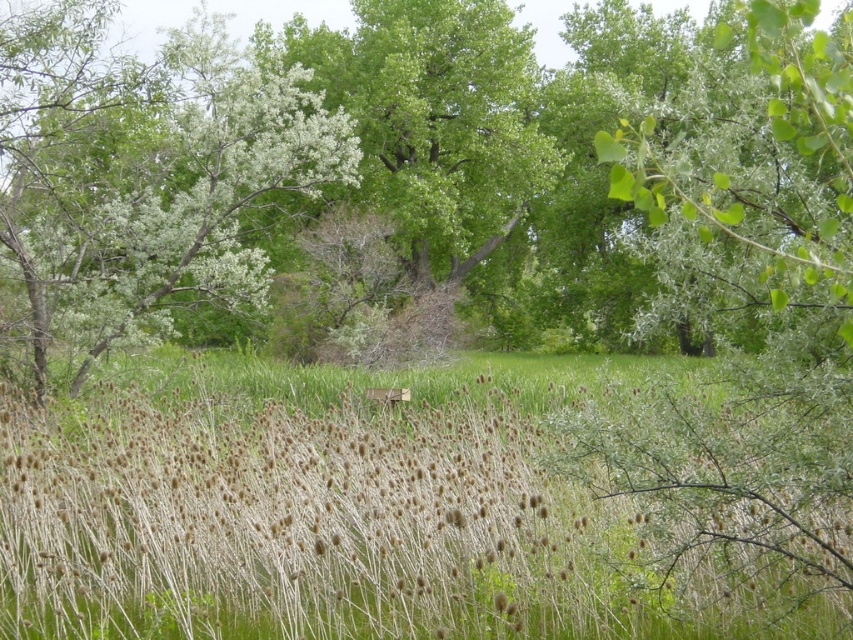
Consider the image. Which is below, brown dry grass at center or green leafy tree at center?

brown dry grass at center is lower down.

Is point (49, 481) positioned before point (817, 564)?

No, (49, 481) is behind (817, 564).

Which is behind, point (508, 536) or point (630, 406)?

Point (508, 536)

You are a GUI agent. You are given a task and a screenshot of the screen. Output one action in this format:
    pyautogui.click(x=<x>, y=<y>)
    Task: Click on the brown dry grass at center
    
    Given the screenshot: What is the action you would take?
    pyautogui.click(x=345, y=512)

Who is lower down, green leafy tree at upper left or green leafy tree at center?

green leafy tree at center is below.

Who is positioned more to the right, green leafy tree at upper left or green leafy tree at center?

From the viewer's perspective, green leafy tree at center appears more on the right side.

The image size is (853, 640). Describe the element at coordinates (141, 177) in the screenshot. I see `green leafy tree at upper left` at that location.

Where is `green leafy tree at upper left`? The width and height of the screenshot is (853, 640). green leafy tree at upper left is located at coordinates (141, 177).

Does brown dry grass at center appear over green leafy tree at upper left?

Incorrect, brown dry grass at center is not positioned above green leafy tree at upper left.

In the scene shown: Who is shorter, brown dry grass at center or green leafy tree at upper left?

brown dry grass at center

This screenshot has height=640, width=853. Describe the element at coordinates (345, 512) in the screenshot. I see `brown dry grass at center` at that location.

Where is `brown dry grass at center`? The height and width of the screenshot is (640, 853). brown dry grass at center is located at coordinates (345, 512).